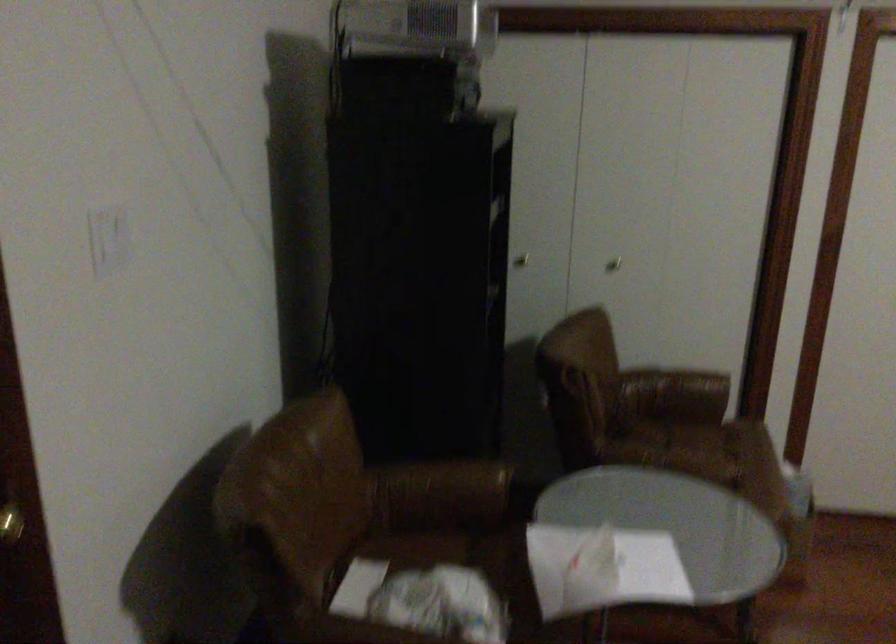
Image resolution: width=896 pixels, height=644 pixels. I want to click on chair sitting surface, so click(x=718, y=442).